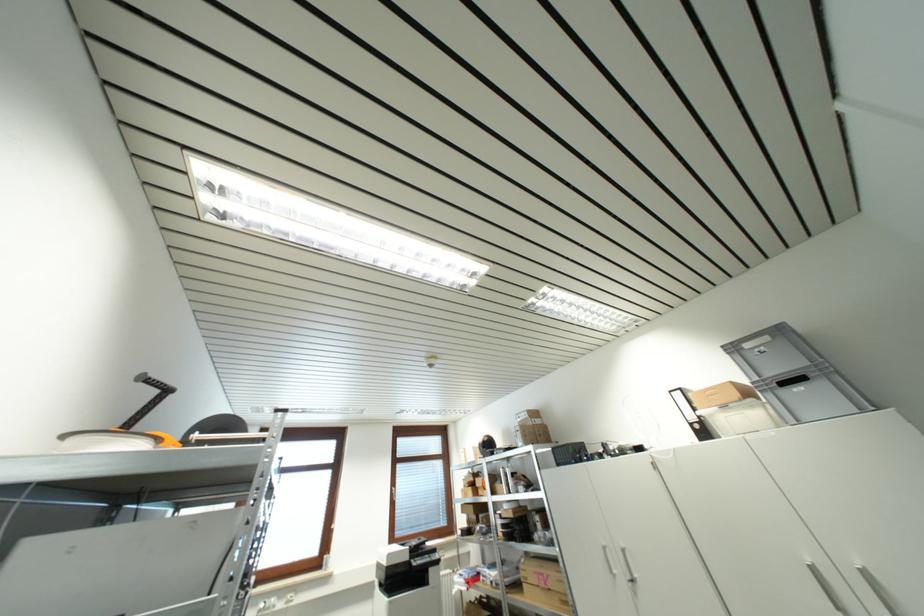
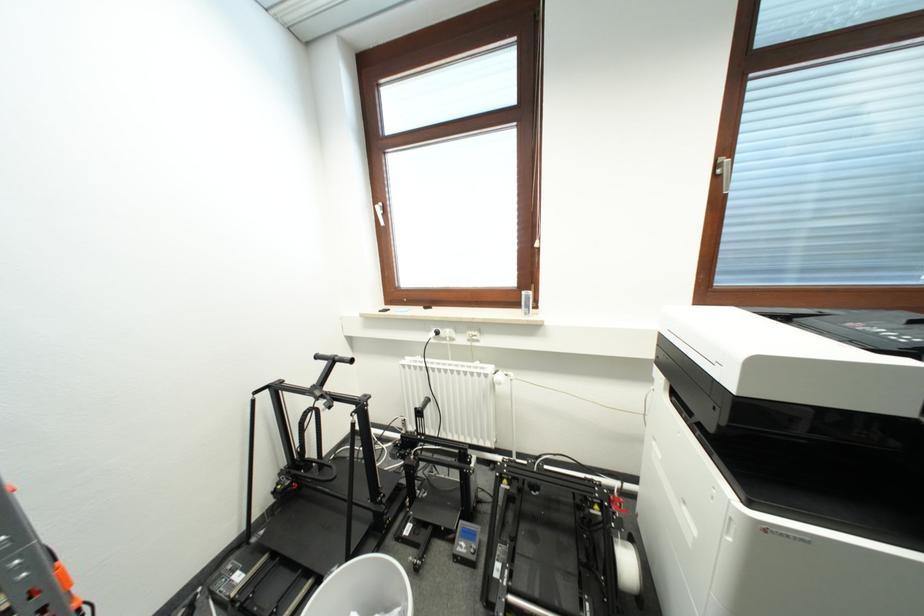
Locate, in the second image, the point that corresponds to point (405, 469) in the first image.

(766, 89)